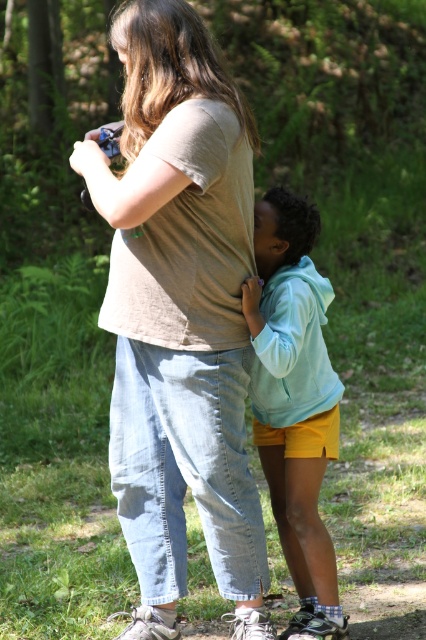
Question: Is matte brown shirt at center positioned behind light blue fleece jacket at center?

Choices:
 (A) yes
 (B) no

Answer: (B)

Question: Which point appears farthest from the camera in this image?

Choices:
 (A) (204, 220)
 (B) (294, 525)

Answer: (B)

Question: Does matte brown shirt at center lie in front of light blue fleece jacket at center?

Choices:
 (A) no
 (B) yes

Answer: (B)

Question: Is matte brown shirt at center bigger than light blue fleece jacket at center?

Choices:
 (A) yes
 (B) no

Answer: (A)